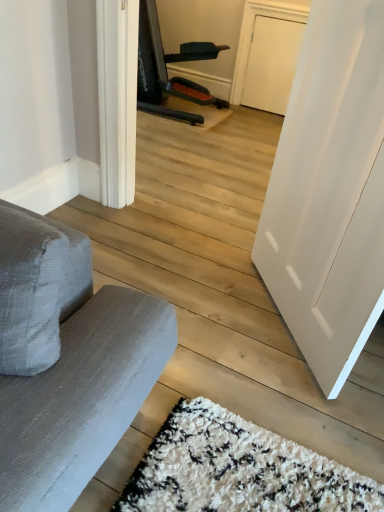
Question: From the image's perspective, is white smooth door at right located above gray fabric armchair at upper left?

Choices:
 (A) yes
 (B) no

Answer: (B)

Question: From the image's perspective, is white smooth door at right located beneath gray fabric armchair at upper left?

Choices:
 (A) yes
 (B) no

Answer: (A)

Question: Does white smooth door at right have a lesser height compared to gray fabric armchair at upper left?

Choices:
 (A) yes
 (B) no

Answer: (B)

Question: Is white smooth door at right next to gray fabric armchair at upper left?

Choices:
 (A) yes
 (B) no

Answer: (B)

Question: Is white smooth door at right looking in the opposite direction of gray fabric armchair at upper left?

Choices:
 (A) no
 (B) yes

Answer: (A)

Question: Is white smooth door at right bigger than gray fabric armchair at upper left?

Choices:
 (A) no
 (B) yes

Answer: (A)

Question: From the image's perspective, is gray fabric armchair at upper left located above white smooth door at right?

Choices:
 (A) no
 (B) yes

Answer: (B)

Question: Can white smooth door at right be found inside gray fabric armchair at upper left?

Choices:
 (A) yes
 (B) no

Answer: (B)

Question: From the image's perspective, is gray fabric armchair at upper left located beneath white smooth door at right?

Choices:
 (A) yes
 (B) no

Answer: (B)

Question: Is gray fabric armchair at upper left completely or partially outside of white smooth door at right?

Choices:
 (A) no
 (B) yes

Answer: (B)

Question: Is gray fabric armchair at upper left positioned behind white smooth door at right?

Choices:
 (A) yes
 (B) no

Answer: (A)

Question: Is gray fabric armchair at upper left facing towards white smooth door at right?

Choices:
 (A) yes
 (B) no

Answer: (B)

Question: Is point (380, 121) closer or farther from the camera than point (180, 81)?

Choices:
 (A) farther
 (B) closer

Answer: (B)